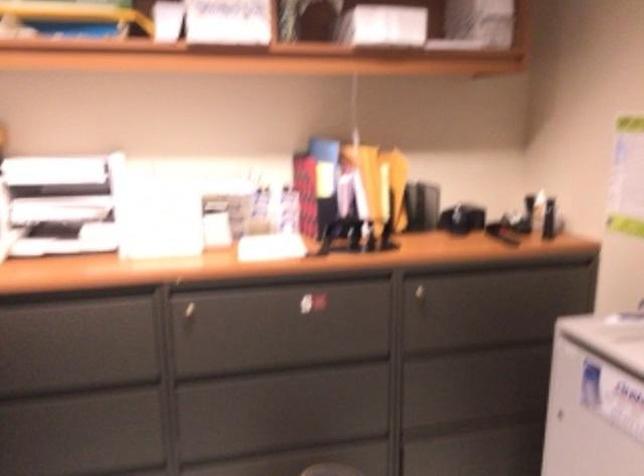
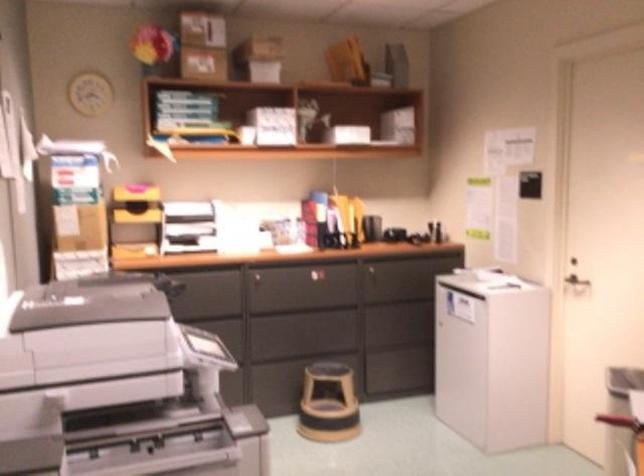
Find the pixel in the second image that matches point (502, 291) in the first image.

(417, 267)